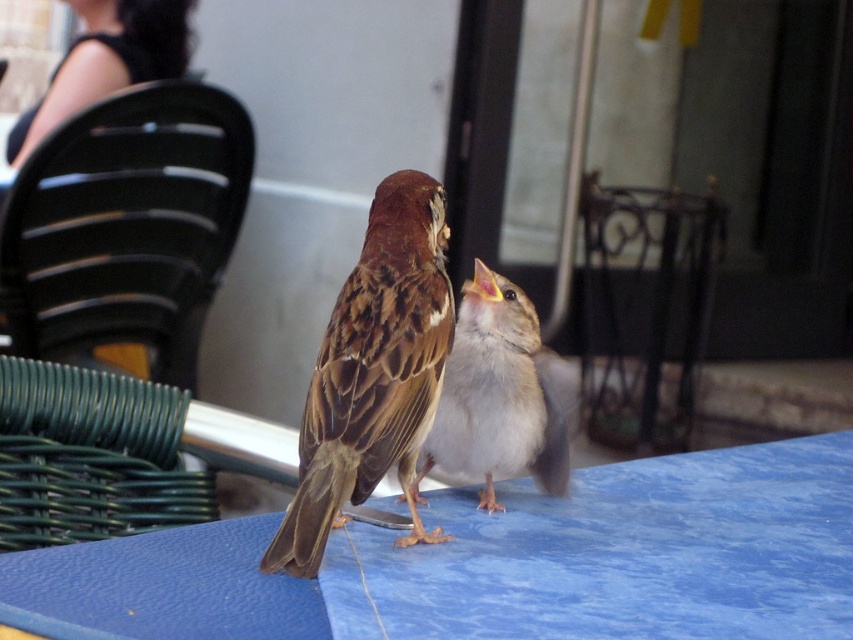
You are a photographer trying to capture the brown feathered sparrow at center in your shot. The camera you are using has a focal length of 50mm and an aperture of f2.8. If the sparrow moves 0.5 meters closer to the camera, will its image on the sensor become larger or smaller?

The image of the brown feathered sparrow at center will become larger on the sensor because when the subject moves closer to the camera, the image size increases due to the inverse relationship between distance and image magnification.

You are standing at the center of the image. Which direction should you move to reach the black plastic chair at upper left?

The black plastic chair at upper left is located at point (x=126, y=225), so you should move towards the upper left direction to reach it.